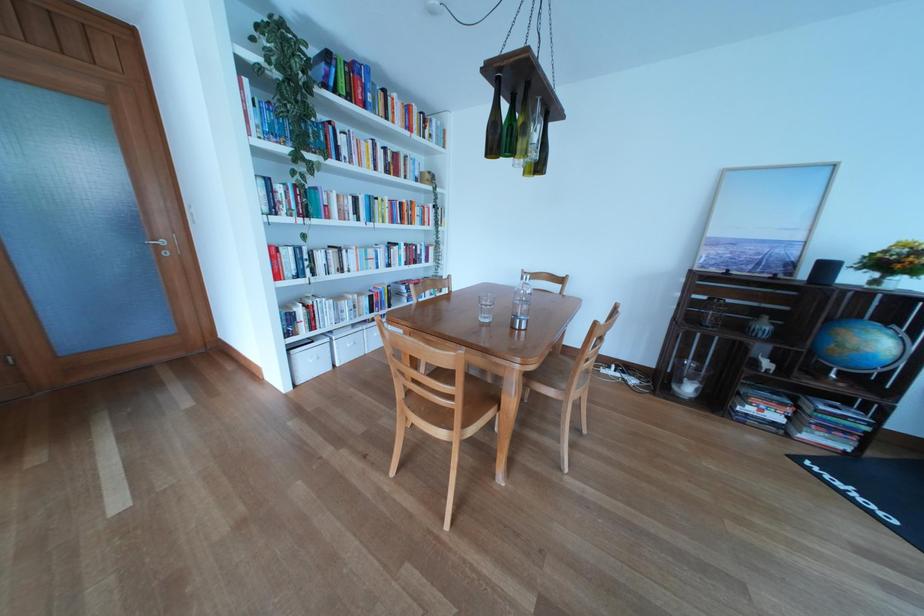
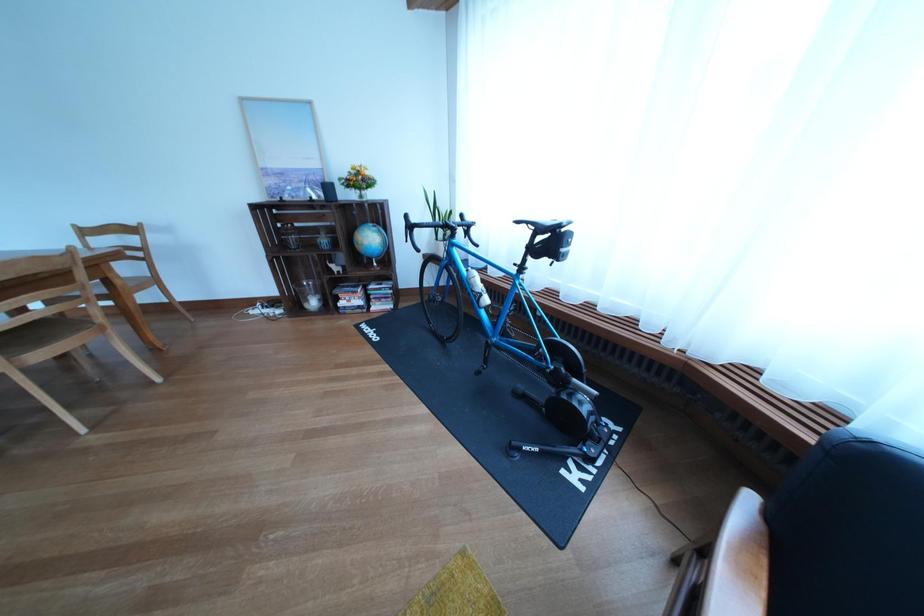
The point at (694,389) is marked in the first image. Where is the corresponding point in the second image?

(321, 306)